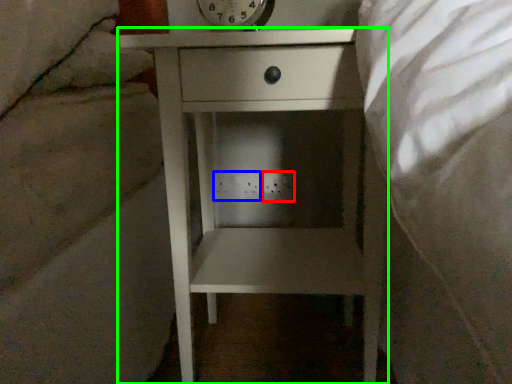
Question: Estimate the real-world distances between objects in this image. Which object is farther from electric outlet (highlighted by a red box), electric outlet (highlighted by a blue box) or nightstand (highlighted by a green box)?

Choices:
 (A) electric outlet
 (B) nightstand

Answer: (B)